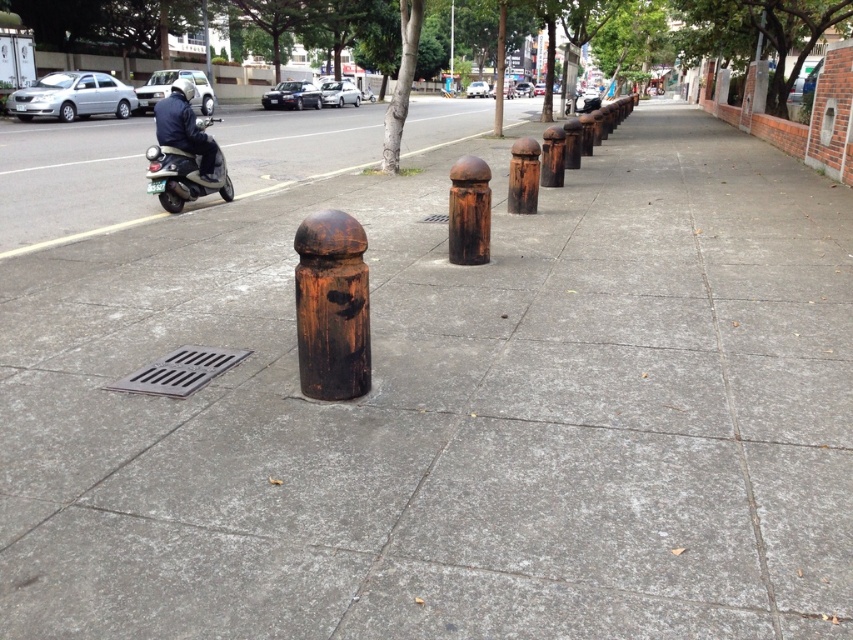
Who is more distant from viewer, (474, 179) or (515, 157)?

The point (515, 157) is more distant.

Who is positioned more to the right, rusty metal bollard at center or rusty metal post at center?

Result: Positioned to the right is rusty metal post at center.

Between point (457, 244) and point (515, 211), which one is positioned in front?

Positioned in front is point (457, 244).

At what (x,y) coordinates should I click in order to perform the action: click on rusty metal bollard at center. Please return your answer as a coordinate pair (x, y). Image resolution: width=853 pixels, height=640 pixels. Looking at the image, I should click on (468, 211).

I want to click on matte black scooter at left, so click(183, 152).

Which is in front, point (149, 166) or point (521, 156)?

Point (521, 156) is in front.

This screenshot has width=853, height=640. I want to click on matte black scooter at left, so click(x=183, y=152).

Can you confirm if rusty wood post at center is positioned below rusty metal bollard at center?

Correct, rusty wood post at center is located below rusty metal bollard at center.

Is point (341, 352) closer to camera compared to point (457, 243)?

Yes, it is.

I want to click on rusty wood post at center, so click(331, 307).